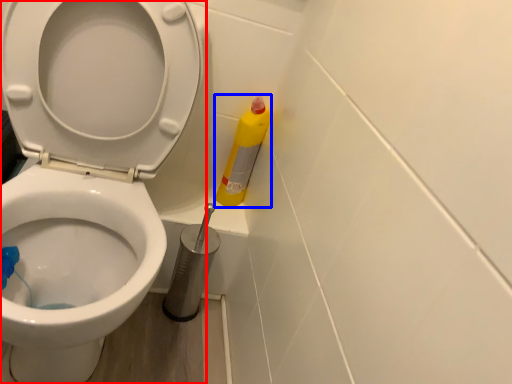
Question: Which object appears closest to the camera in this image, toilet (highlighted by a red box) or cleaning product (highlighted by a blue box)?

Choices:
 (A) toilet
 (B) cleaning product

Answer: (A)